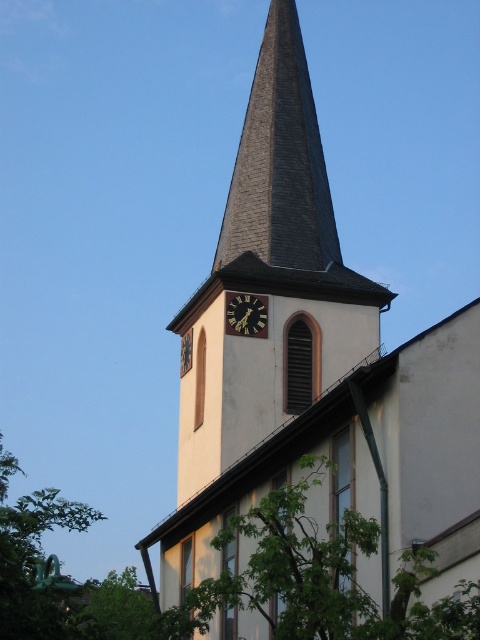
Is green leafy tree at lower center above dark gray shingles at center?

Incorrect, green leafy tree at lower center is not positioned above dark gray shingles at center.

Between green leafy tree at lower center and dark gray shingles at center, which one appears on the left side from the viewer's perspective?

dark gray shingles at center is more to the left.

Is point (204, 618) positioned before point (273, 262)?

Yes, point (204, 618) is closer to viewer.

In order to click on green leafy tree at lower center in this screenshot , I will do `click(326, 576)`.

Is white smooth steeple at center thinner than green leafy tree at lower center?

No.

From the picture: Is white smooth steeple at center closer to camera compared to green leafy tree at lower center?

No, it is not.

Does point (339, 483) come farther from viewer compared to point (347, 589)?

Yes, point (339, 483) is farther from viewer.

In order to click on white smooth steeple at center in this screenshot , I will do `click(313, 365)`.

Who is lower down, white smooth steeple at center or dark gray shingles at center?

white smooth steeple at center is lower down.

Between point (144, 547) and point (271, 141), which one is positioned in front?

Point (144, 547) is more forward.

This screenshot has width=480, height=640. I want to click on white smooth steeple at center, so click(313, 365).